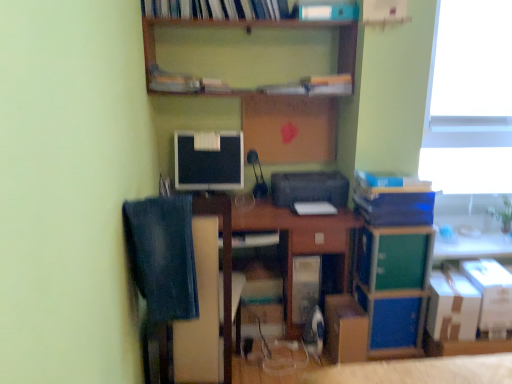
This screenshot has width=512, height=384. What are the coordinates of `free spot above blue cardboard book at right, the second book positioned from the right (from a real-world perspective)` in the screenshot? It's located at (401, 180).